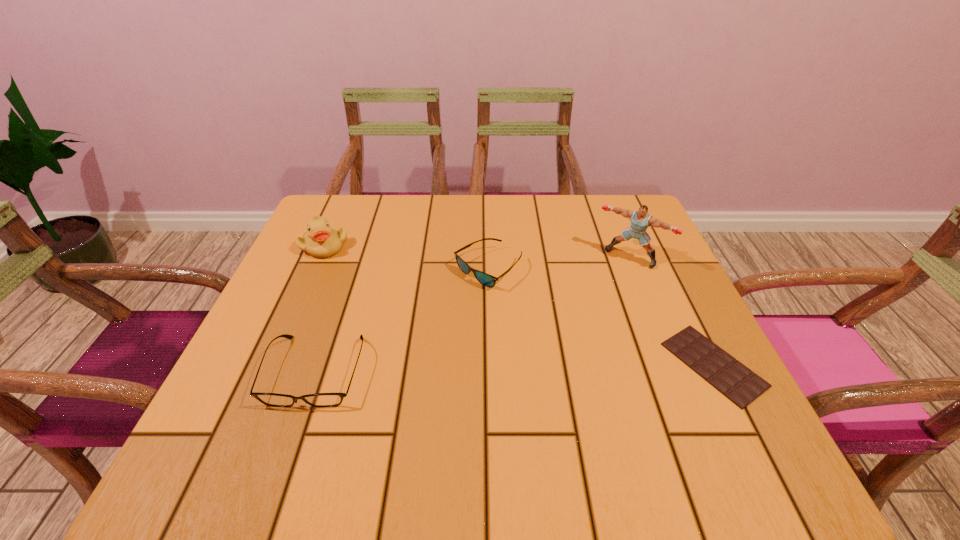
Where is `duckling that is at the left edge`? The width and height of the screenshot is (960, 540). duckling that is at the left edge is located at coordinates (322, 240).

At what (x,y) coordinates should I click in order to perform the action: click on chocolate bar at the right edge. Please return your answer as a coordinate pair (x, y). Image resolution: width=960 pixels, height=540 pixels. Looking at the image, I should click on (738, 383).

Identify the location of puncher at the right edge. (640, 220).

Where is `object present at the far left corner`? The width and height of the screenshot is (960, 540). object present at the far left corner is located at coordinates (322, 240).

Image resolution: width=960 pixels, height=540 pixels. Find the location of `object that is at the near left corner`. object that is at the near left corner is located at coordinates (270, 399).

I want to click on object that is positioned at the far right corner, so click(640, 220).

The image size is (960, 540). I want to click on object at the near right corner, so click(738, 383).

In the image, there is a desktop. Where is `vacant space at the far edge`? vacant space at the far edge is located at coordinates (403, 215).

In the image, there is a desktop. Identify the location of free region at the near edge. (397, 424).

Find the location of a particular element. The width and height of the screenshot is (960, 540). free spot at the left edge of the desktop is located at coordinates (293, 377).